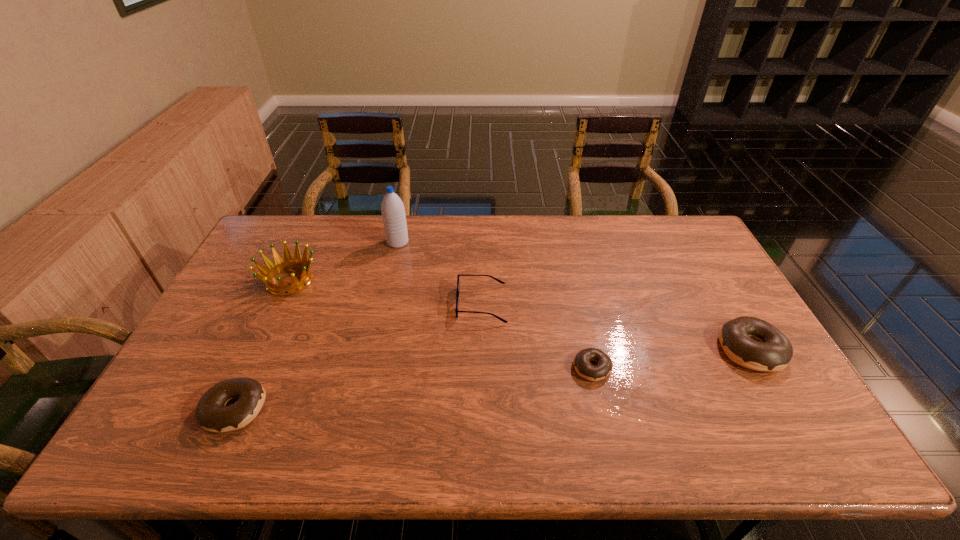
This screenshot has height=540, width=960. Find the location of `object positioned at the right edge`. object positioned at the right edge is located at coordinates (772, 351).

Locate an element on the screen. This screenshot has height=540, width=960. object that is at the near left corner is located at coordinates (211, 413).

In the image, there is a desktop. Where is `vacant area at the far edge`? The width and height of the screenshot is (960, 540). vacant area at the far edge is located at coordinates (441, 228).

Locate an element on the screen. vacant space at the near edge of the desktop is located at coordinates (564, 409).

Identify the location of free space at the left edge. (245, 266).

In the image, there is a desktop. At what (x,y) coordinates should I click in order to perform the action: click on blank space at the right edge. Please return your answer as a coordinate pair (x, y). Looking at the image, I should click on (666, 260).

Locate an element on the screen. This screenshot has height=540, width=960. blank area at the near left corner is located at coordinates tap(192, 399).

This screenshot has width=960, height=540. Identify the location of vacant position at the near right corner of the desktop. (745, 415).

Where is `free space between the leftmost doughnut and the shortest object`? The height and width of the screenshot is (540, 960). free space between the leftmost doughnut and the shortest object is located at coordinates (413, 388).

The height and width of the screenshot is (540, 960). I want to click on free spot between the tallest object and the leftmost doughnut, so click(x=316, y=326).